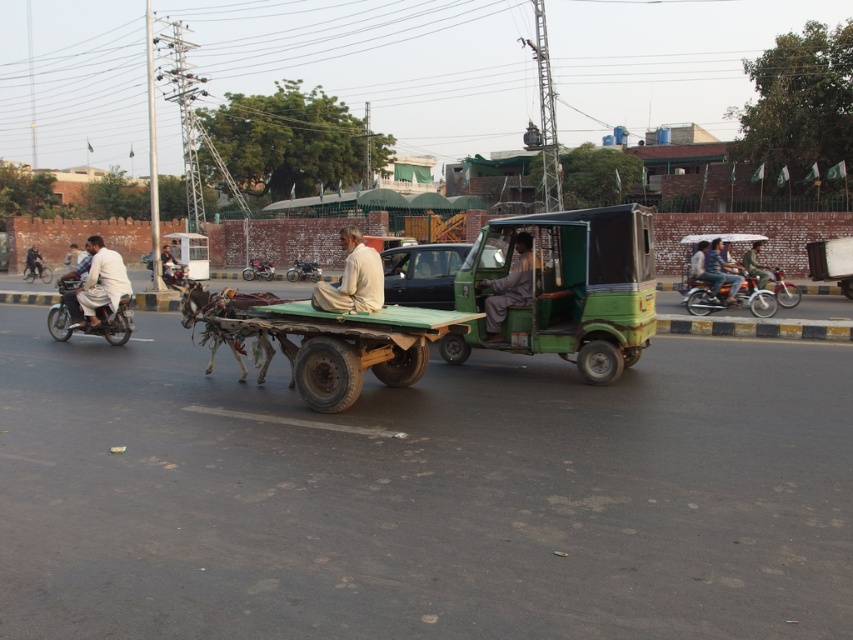
You are a tourist standing in the street and want to take a photo of the brown leather donkey at center and the dark brown leather jacket at left. Which object should you focus on first if you want both to be in focus?

The brown leather donkey at center is closer to the viewer than the dark brown leather jacket at left, so you should focus on the brown leather donkey at center first to ensure both are in focus.

You are a pedestrian standing at the center of the street. You see a light beige fabric at center and jeans at center. Which item takes up more space in the scene?

The jeans at center occupies more space than the light beige fabric at center.

You are a pedestrian standing on the street and see the jeans at center and the dark brown leather jacket at left. Which clothing item is closer to you?

The jeans at center is in front of dark brown leather jacket at left, so the jeans at center is closer to you.